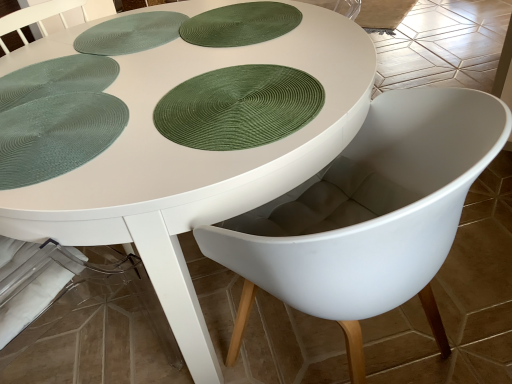
This screenshot has width=512, height=384. In order to click on vacant space behind green textured placemat at upper left, which appears as the 3th paper plate when ordered from the bottom in this screenshot , I will do `click(82, 45)`.